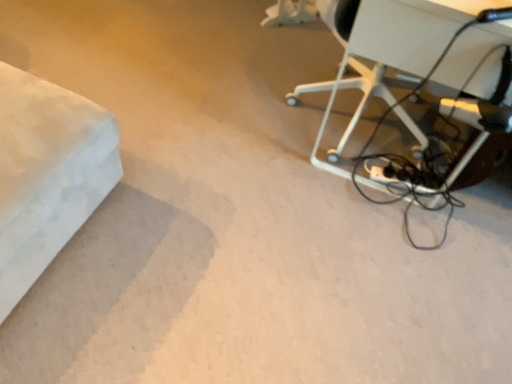
Question: Is white plastic table at upper right bigger or smaller than black matte extension cord at lower right?

Choices:
 (A) big
 (B) small

Answer: (A)

Question: From a real-world perspective, is white plastic table at upper right above or below black matte extension cord at lower right?

Choices:
 (A) below
 (B) above

Answer: (B)

Question: Is point (445, 3) positioned closer to the camera than point (380, 172)?

Choices:
 (A) closer
 (B) farther

Answer: (A)

Question: Looking at their shapes, would you say black matte extension cord at lower right is wider or thinner than white plastic table at upper right?

Choices:
 (A) wide
 (B) thin

Answer: (B)

Question: In terms of height, does black matte extension cord at lower right look taller or shorter compared to white plastic table at upper right?

Choices:
 (A) short
 (B) tall

Answer: (A)

Question: Would you say black matte extension cord at lower right is inside or outside white plastic table at upper right?

Choices:
 (A) outside
 (B) inside

Answer: (B)

Question: Considering the positions of black matte extension cord at lower right and white plastic table at upper right in the image, is black matte extension cord at lower right bigger or smaller than white plastic table at upper right?

Choices:
 (A) small
 (B) big

Answer: (A)